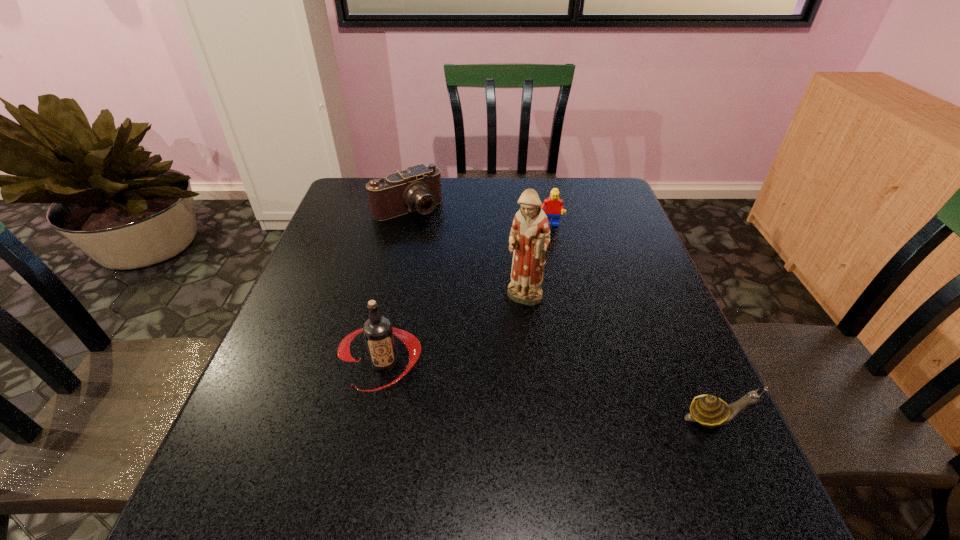
What are the coordinates of `root beer` in the screenshot? It's located at (378, 332).

In order to click on the fourth farthest object in this screenshot , I will do `click(378, 332)`.

Locate an element on the screen. This screenshot has height=540, width=960. the rightmost object is located at coordinates (710, 411).

Where is `snail`? The height and width of the screenshot is (540, 960). snail is located at coordinates (710, 411).

Where is `camera`? camera is located at coordinates tap(418, 188).

Find the location of a particular element. Image resolution: width=960 pixels, height=540 pixels. Lego is located at coordinates (553, 205).

Find the location of a particular element. This screenshot has height=540, width=960. the tallest object is located at coordinates (529, 238).

At what (x,y) coordinates should I click in order to perform the action: click on the third nearest object. Please return your answer as a coordinate pair (x, y). This screenshot has width=960, height=540. Looking at the image, I should click on (529, 238).

In order to click on vacant point located 0.070m on the label of the fourth farthest object in this screenshot , I will do `click(372, 427)`.

The width and height of the screenshot is (960, 540). Identify the location of vacant region located 0.380m on the front-facing side of the camera. (488, 296).